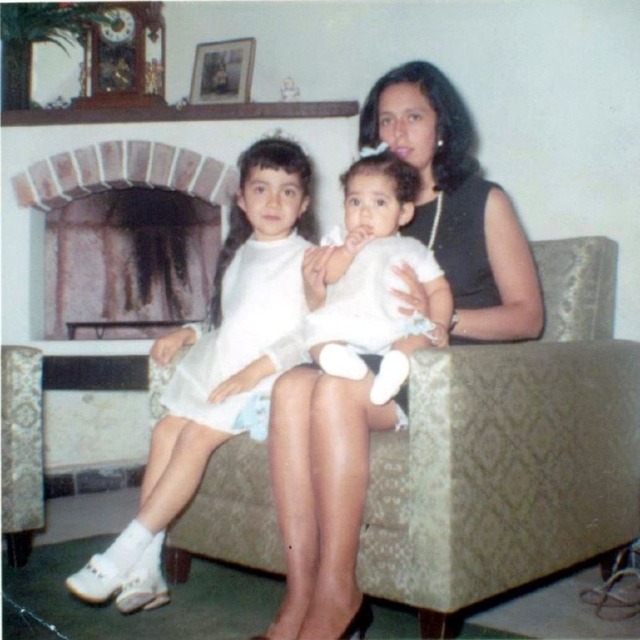
Image resolution: width=640 pixels, height=640 pixels. What are the coordinates of `white soft baby at center` in the screenshot? It's located at (374, 278).

How much distance is there between white soft baby at center and brick fireplace at upper left?

1.74 meters

Describe the element at coordinates (374, 278) in the screenshot. I see `white soft baby at center` at that location.

Identify the location of white soft baby at center. This screenshot has width=640, height=640. (374, 278).

What do you see at coordinates (509, 451) in the screenshot? This screenshot has height=640, width=640. I see `green textured couch at center` at bounding box center [509, 451].

Does green textured couch at center have a greater height compared to brick fireplace at upper left?

Correct, green textured couch at center is much taller as brick fireplace at upper left.

Which is behind, point (531, 419) or point (122, 170)?

Point (122, 170)

Where is `green textured couch at center`? green textured couch at center is located at coordinates (509, 451).

Can you confirm if white matte dress at center is bigger than brick fireplace at upper left?

Indeed, white matte dress at center has a larger size compared to brick fireplace at upper left.

Is white matte dress at center closer to the viewer compared to brick fireplace at upper left?

That is True.

Is point (163, 589) farther from camera compared to point (173, 145)?

No, (163, 589) is closer to viewer.

Identify the location of white matte dress at center. This screenshot has width=640, height=640. (218, 368).